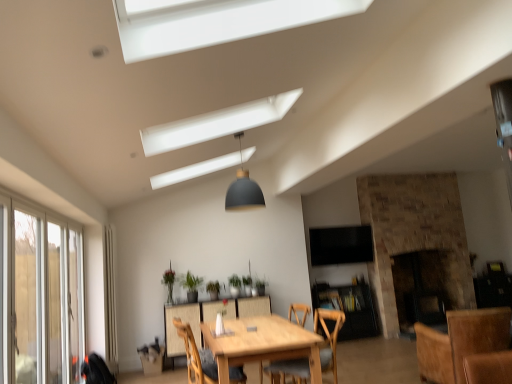
Question: Can you confirm if green matte plant at center, which is the fourth plant from left to right, is taller than green matte plant at center, placed as the third plant when sorted from right to left?

Choices:
 (A) yes
 (B) no

Answer: (B)

Question: From the image's perspective, is green matte plant at center, which is the fourth plant from left to right, over green matte plant at center, marked as the second plant in a left-to-right arrangement?

Choices:
 (A) no
 (B) yes

Answer: (A)

Question: Is green matte plant at center, positioned as the 1th plant in right-to-left order, placed right next to green matte plant at center, marked as the second plant in a left-to-right arrangement?

Choices:
 (A) no
 (B) yes

Answer: (A)

Question: Can you confirm if green matte plant at center, which is the fourth plant from left to right, is thinner than green matte plant at center, marked as the second plant in a left-to-right arrangement?

Choices:
 (A) no
 (B) yes

Answer: (B)

Question: Would you say green matte plant at center, positioned as the 1th plant in right-to-left order, contains green matte plant at center, marked as the second plant in a left-to-right arrangement?

Choices:
 (A) no
 (B) yes

Answer: (A)

Question: From a real-world perspective, is clear glass screen door at left positioned above or below light brown wooden table at center?

Choices:
 (A) below
 (B) above

Answer: (B)

Question: Is clear glass screen door at left taller or shorter than light brown wooden table at center?

Choices:
 (A) short
 (B) tall

Answer: (B)

Question: From the image's perspective, relative to light brown wooden table at center, is clear glass screen door at left above or below?

Choices:
 (A) above
 (B) below

Answer: (A)

Question: Is clear glass screen door at left situated inside light brown wooden table at center or outside?

Choices:
 (A) outside
 (B) inside

Answer: (A)

Question: Is green matte plant at center, placed as the third plant when sorted from right to left, to the left or to the right of green matte plant at center, the second plant positioned from the right, in the image?

Choices:
 (A) left
 (B) right

Answer: (A)

Question: Would you say green matte plant at center, placed as the third plant when sorted from right to left, is inside or outside green matte plant at center, positioned as the 3th plant in left-to-right order?

Choices:
 (A) inside
 (B) outside

Answer: (B)

Question: Is green matte plant at center, marked as the second plant in a left-to-right arrangement, wider or thinner than green matte plant at center, the second plant positioned from the right?

Choices:
 (A) wide
 (B) thin

Answer: (B)

Question: Based on their sizes in the image, would you say green matte plant at center, marked as the second plant in a left-to-right arrangement, is bigger or smaller than green matte plant at center, positioned as the 3th plant in left-to-right order?

Choices:
 (A) small
 (B) big

Answer: (B)

Question: Would you say light brown wooden table at center is to the left or to the right of green matte plant at center, placed as the third plant when sorted from right to left, in the picture?

Choices:
 (A) right
 (B) left

Answer: (A)

Question: From a real-world perspective, is light brown wooden table at center physically located above or below green matte plant at center, placed as the third plant when sorted from right to left?

Choices:
 (A) below
 (B) above

Answer: (A)